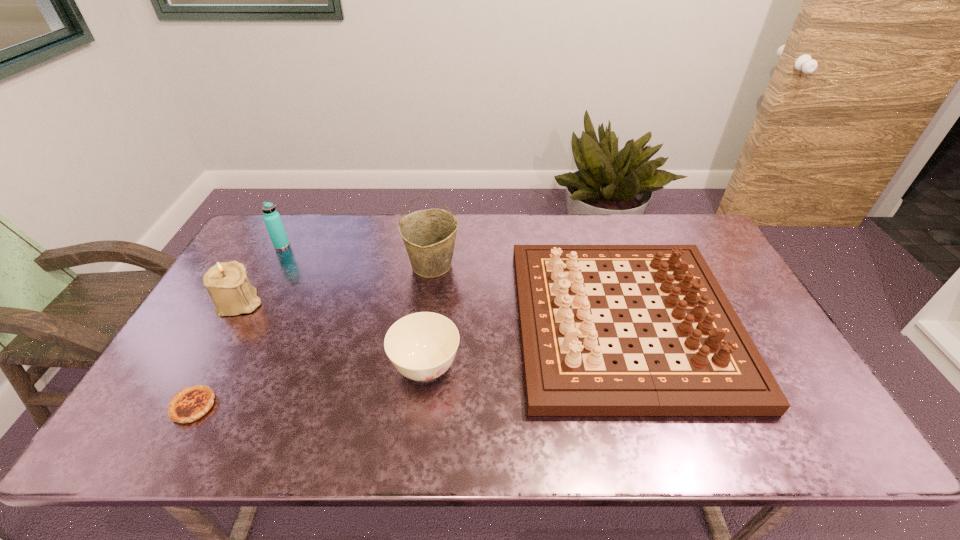
The width and height of the screenshot is (960, 540). Identify the location of empty space between the second shortest object and the shortest object. (309, 387).

Locate an element on the screen. free space between the quiche and the water bottle is located at coordinates (237, 326).

The height and width of the screenshot is (540, 960). Find the location of `empty space between the quiche and the water bottle`. empty space between the quiche and the water bottle is located at coordinates (237, 326).

The width and height of the screenshot is (960, 540). Identify the location of vacant area between the wine bucket and the water bottle. (357, 255).

Point out which object is positioned as the fifth nearest to the third shortest object. Please provide its 2D coordinates. Your answer should be formatted as a tuple, i.e. [(x, y)], where the tuple contains the x and y coordinates of a point satisfying the conditions above.

[(273, 222)]

Where is `object that ranks as the closest to the third shortest object`? object that ranks as the closest to the third shortest object is located at coordinates (422, 346).

This screenshot has height=540, width=960. I want to click on free space that satisfies the following two spatial constraints: 1. on the back side of the candle_holder; 2. on the left side of the wine bucket, so click(x=260, y=266).